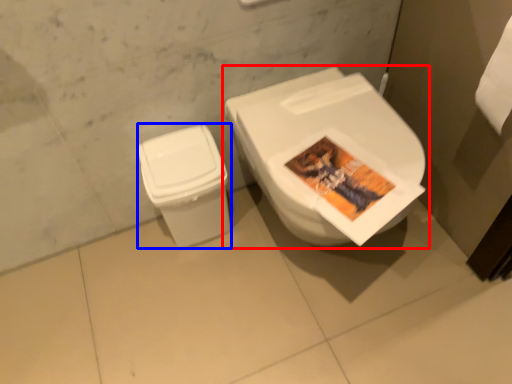
Question: Which object appears closest to the camera in this image, toilet (highlighted by a red box) or toilet bowl (highlighted by a blue box)?

Choices:
 (A) toilet
 (B) toilet bowl

Answer: (A)